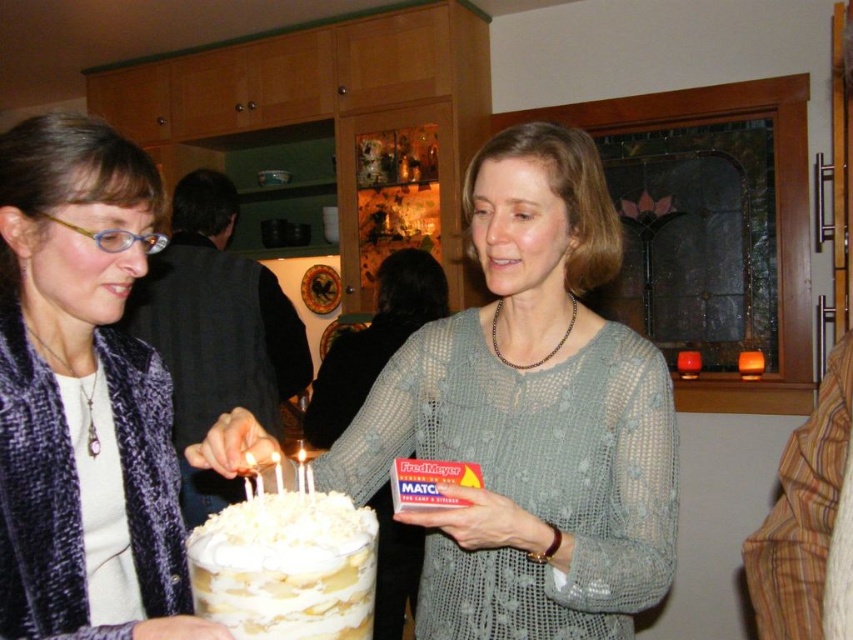
You are a photographer trying to capture a clear shot of the white fluffy cake at center without the matte gray sweater at center blocking it. Based on their positions, can you adjust your angle to do so?

The matte gray sweater at center is further to the viewer than the white fluffy cake at center, so you can move your camera position slightly to the side or angle it downward to avoid the sweater blocking the cake.